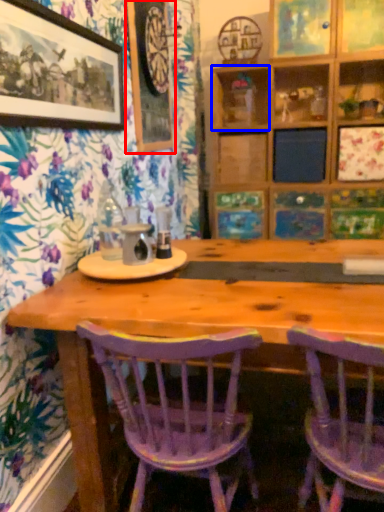
Question: Which point is closer to the camera, picture frame (highlighted by a red box) or shelf (highlighted by a blue box)?

Choices:
 (A) picture frame
 (B) shelf

Answer: (A)